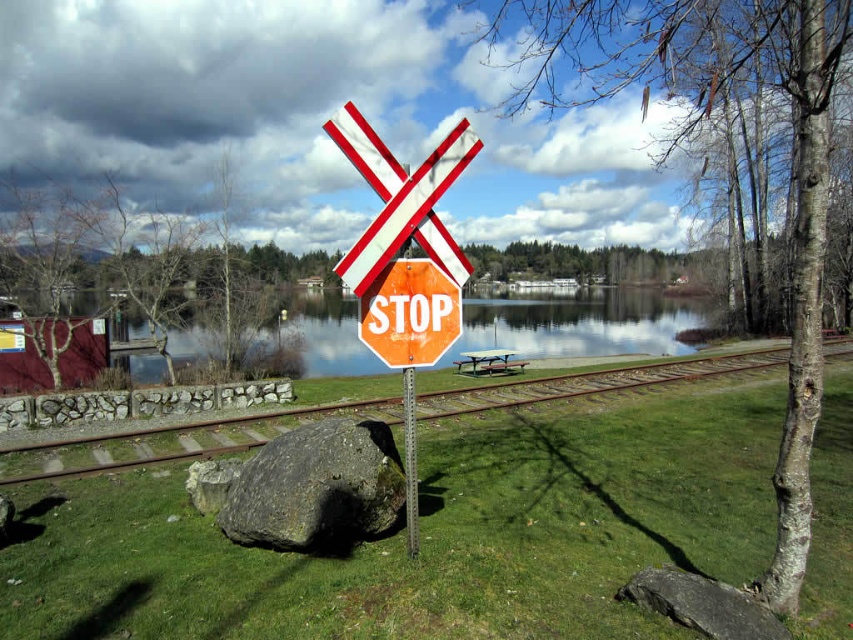
Question: Where is orange matte stop sign at center located in relation to metallic pole at center in the image?

Choices:
 (A) above
 (B) below

Answer: (A)

Question: Which object is closer to the camera taking this photo?

Choices:
 (A) metal train track at center
 (B) rough textured rock at center
 (C) orange matte stop sign at center
 (D) metallic pole at center

Answer: (C)

Question: Which point is farther to the camera?

Choices:
 (A) orange reflective stop sign at center
 (B) metallic pole at center

Answer: (B)

Question: Is metal train track at center further to the viewer compared to orange reflective stop sign at center?

Choices:
 (A) yes
 (B) no

Answer: (A)

Question: Which point is farther to the camera?

Choices:
 (A) coord(264,417)
 (B) coord(415,445)
 (C) coord(498,602)
 (D) coord(363,285)

Answer: (A)

Question: Can you confirm if rough textured rock at center is wider than orange matte stop sign at center?

Choices:
 (A) yes
 (B) no

Answer: (A)